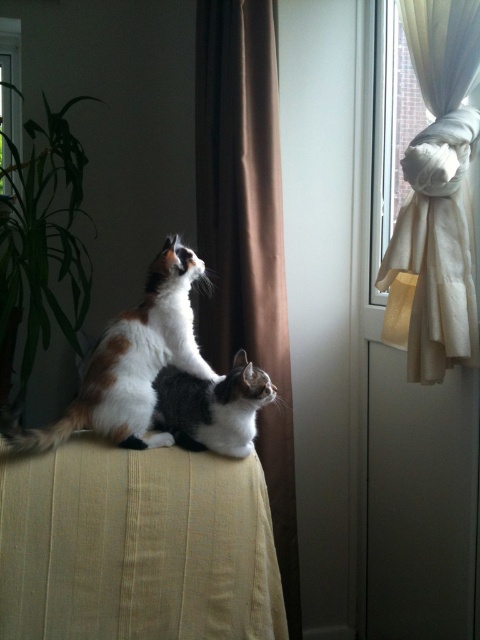
You are taking a photo of the two cats in the scene. You want to focus on the cat at point (x=204, y=1) first. Will the cat at point (x=423, y=330) be in focus if you focus on the first cat?

Since point (x=204, y=1) is closer to the camera than point (x=423, y=330), focusing on the first cat will likely leave the second cat slightly out of focus unless the depth of field is sufficient to cover both distances.

You are a cat owner who wants to ensure your cats have enough space to stretch out comfortably on the cushioned surface. Given the size relationship between the calico fur cat at center and the transparent glass window at upper center, can you determine if the cats have enough space to stretch out on the cushioned surface?

The calico fur cat at center is smaller than the transparent glass window at upper center, but the window size does not directly indicate the cushioned surface area. The cats may have enough space if the cushion is large enough for their combined size.